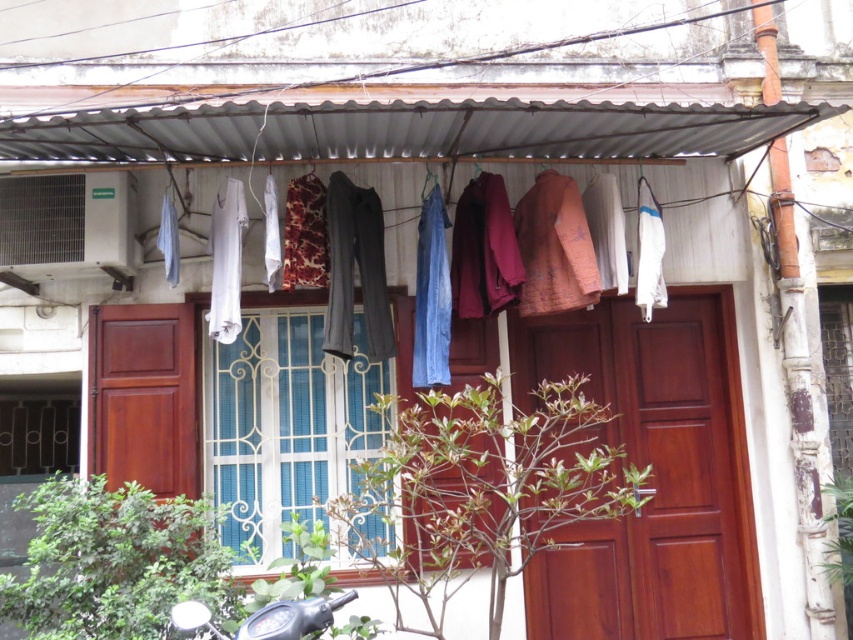
You are a delivery person trying to deliver a package to the door. You notice the blue fabric pants at upper center and the metallic silver motorcycle at lower left. Which object is bigger in size?

The blue fabric pants at upper center is larger in size than the metallic silver motorcycle at lower left.

Please look at the point marked at coordinate (395, 212). What object is located there?

The point at coordinate (395, 212) corresponds to the blue fabric pants at upper center.

In the scene shown: You are a delivery person trying to reach the door. There is a blue fabric pants at upper center and a metallic silver motorcycle at lower left in the way. Which object is closer to the door?

The metallic silver motorcycle at lower left is closer to the door because it is below the blue fabric pants at upper center, which is positioned above it.